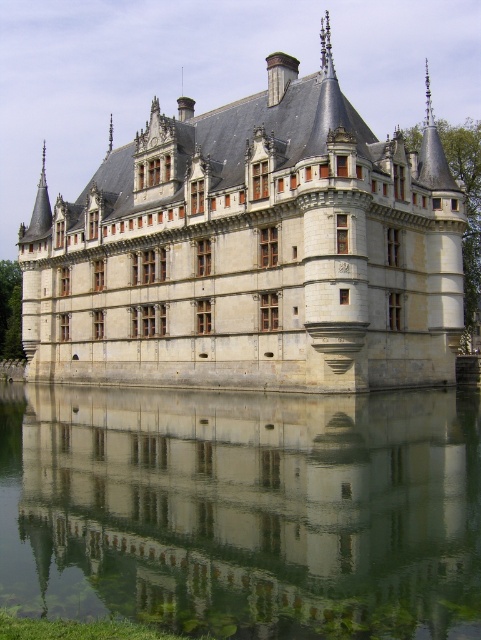
Question: Can you confirm if stone castle at center is positioned to the left of transparent glass water at center?

Choices:
 (A) yes
 (B) no

Answer: (B)

Question: Which point is closer to the camera?

Choices:
 (A) stone castle at center
 (B) transparent glass water at center

Answer: (B)

Question: Does stone castle at center appear on the right side of transparent glass water at center?

Choices:
 (A) yes
 (B) no

Answer: (A)

Question: Is stone castle at center positioned before transparent glass water at center?

Choices:
 (A) no
 (B) yes

Answer: (A)

Question: Which point is closer to the camera taking this photo?

Choices:
 (A) (142, 259)
 (B) (380, 465)

Answer: (B)